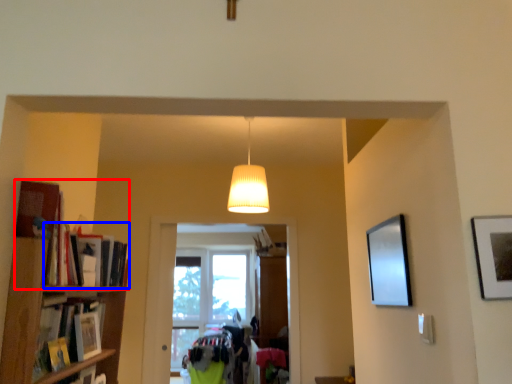
Question: Which object is closer to the camera taking this photo, book (highlighted by a red box) or book (highlighted by a blue box)?

Choices:
 (A) book
 (B) book

Answer: (A)